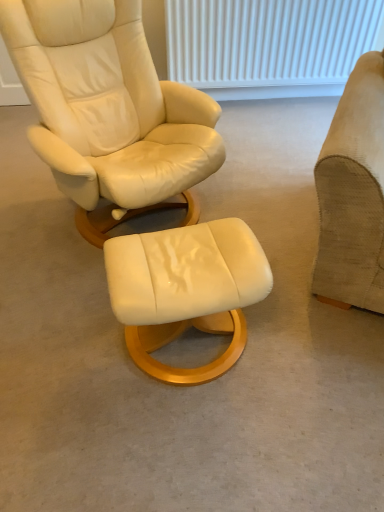
Question: Is white textured radiator at upper center not inside matte cream leather stool at center?

Choices:
 (A) yes
 (B) no

Answer: (A)

Question: Considering the relative sizes of white textured radiator at upper center and matte cream leather stool at center in the image provided, is white textured radiator at upper center wider than matte cream leather stool at center?

Choices:
 (A) no
 (B) yes

Answer: (A)

Question: Would you say white textured radiator at upper center contains matte cream leather stool at center?

Choices:
 (A) yes
 (B) no

Answer: (B)

Question: Is there a large distance between white textured radiator at upper center and matte cream leather stool at center?

Choices:
 (A) no
 (B) yes

Answer: (B)

Question: From a real-world perspective, is white textured radiator at upper center under matte cream leather stool at center?

Choices:
 (A) no
 (B) yes

Answer: (A)

Question: Is point (314, 72) closer or farther from the camera than point (235, 342)?

Choices:
 (A) farther
 (B) closer

Answer: (A)

Question: Is white textured radiator at upper center situated inside matte cream leather stool at center or outside?

Choices:
 (A) inside
 (B) outside

Answer: (B)

Question: Based on their positions, is white textured radiator at upper center located to the left or right of matte cream leather stool at center?

Choices:
 (A) right
 (B) left

Answer: (A)

Question: From the image's perspective, is white textured radiator at upper center positioned above or below matte cream leather stool at center?

Choices:
 (A) above
 (B) below

Answer: (A)

Question: In the image, is matte cream leather stool at center on the left side or the right side of suede beige armchair at right?

Choices:
 (A) right
 (B) left

Answer: (B)

Question: From the image's perspective, is matte cream leather stool at center located above or below suede beige armchair at right?

Choices:
 (A) above
 (B) below

Answer: (B)

Question: From a real-world perspective, is matte cream leather stool at center positioned above or below suede beige armchair at right?

Choices:
 (A) below
 (B) above

Answer: (A)

Question: Is matte cream leather stool at center taller or shorter than suede beige armchair at right?

Choices:
 (A) short
 (B) tall

Answer: (A)

Question: From the image's perspective, is suede beige armchair at right located above or below white textured radiator at upper center?

Choices:
 (A) above
 (B) below

Answer: (B)

Question: Is suede beige armchair at right wider or thinner than white textured radiator at upper center?

Choices:
 (A) wide
 (B) thin

Answer: (A)